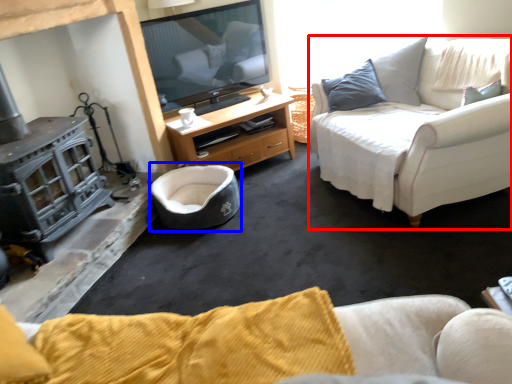
Question: Which object appears closest to the camera in this image, studio couch (highlighted by a red box) or bean bag chair (highlighted by a blue box)?

Choices:
 (A) studio couch
 (B) bean bag chair

Answer: (A)